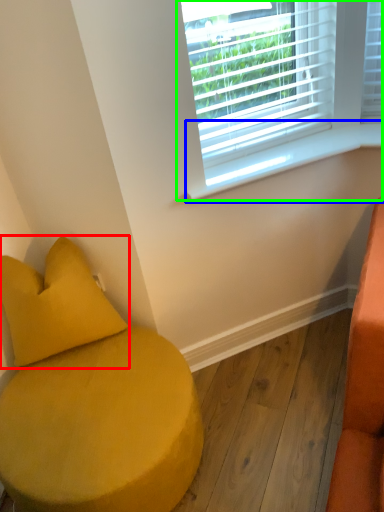
Question: Which is nearer to the pillow (highlighted by a red box)? window sill (highlighted by a blue box) or window (highlighted by a green box).

Choices:
 (A) window sill
 (B) window

Answer: (A)